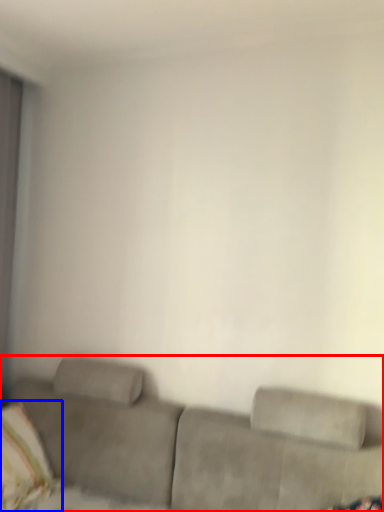
Question: Which of the following is the farthest to the observer, studio couch (highlighted by a red box) or pillow (highlighted by a blue box)?

Choices:
 (A) studio couch
 (B) pillow

Answer: (B)